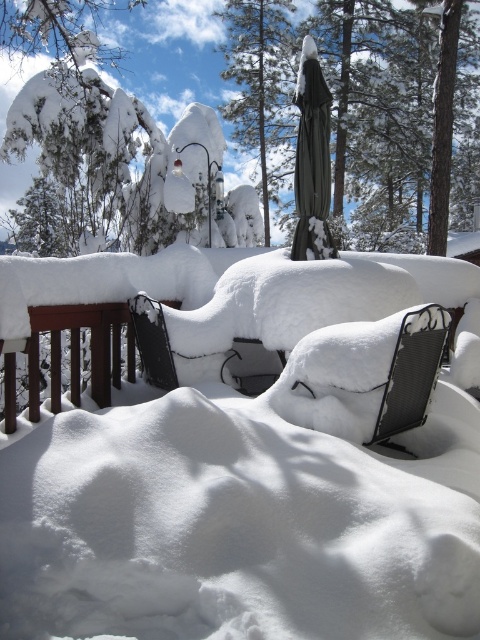
You are standing on the deck in the winter scene and want to walk towards the snow covered chairs and tables. Which point, point [443,310] or point [267,172], is closer to your current position on the deck?

Point [443,310] is closer to your current position on the deck because it is in front of point [267,172].